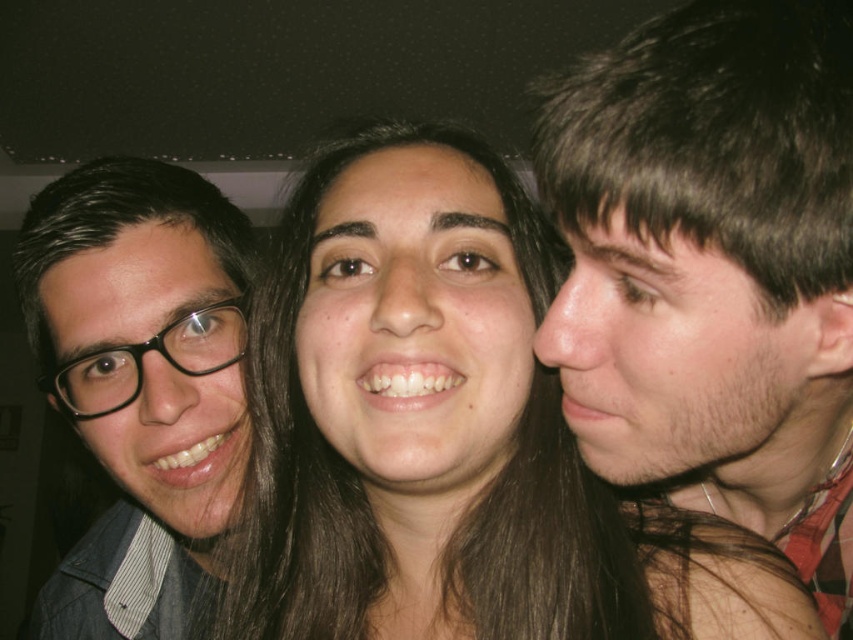
Who is shorter, smooth skin face at center or matte black glasses at left?

smooth skin face at center is shorter.

You are a GUI agent. You are given a task and a screenshot of the screen. Output one action in this format:
    pyautogui.click(x=<x>, y=<y>)
    Task: Click on the smooth skin face at center
    
    Given the screenshot: What is the action you would take?
    pyautogui.click(x=434, y=422)

Describe the element at coordinates (434, 422) in the screenshot. Image resolution: width=853 pixels, height=640 pixels. I see `smooth skin face at center` at that location.

Find the location of a particular element. This screenshot has width=853, height=640. smooth skin face at center is located at coordinates (434, 422).

Is smooth skin face at right closer to the viewer compared to smooth skin face at center?

Yes, it is.

Is smooth skin face at right taller than smooth skin face at center?

Correct, smooth skin face at right is much taller as smooth skin face at center.

Describe the element at coordinates (714, 268) in the screenshot. I see `smooth skin face at right` at that location.

Find the location of a particular element. Image resolution: width=853 pixels, height=640 pixels. smooth skin face at right is located at coordinates (714, 268).

Is smooth skin face at right below matte black glasses at left?

No, smooth skin face at right is not below matte black glasses at left.

Is smooth skin face at right to the left of matte black glasses at left from the viewer's perspective?

Incorrect, smooth skin face at right is not on the left side of matte black glasses at left.

Describe the element at coordinates (714, 268) in the screenshot. I see `smooth skin face at right` at that location.

I want to click on smooth skin face at right, so click(x=714, y=268).